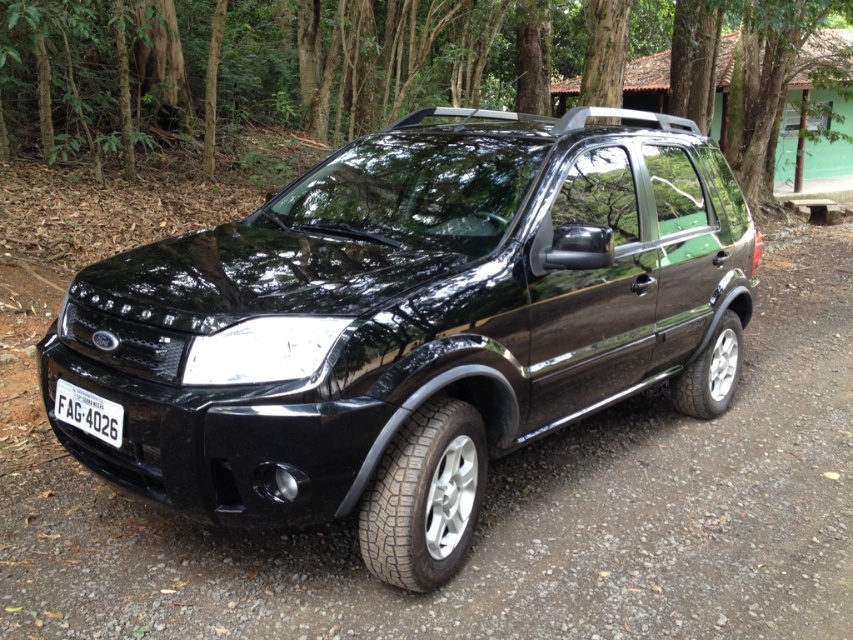
Question: Which of the following is the closest to the observer?

Choices:
 (A) black plastic license plate at lower left
 (B) green leafy tree at center
 (C) glossy black suv at center

Answer: (C)

Question: Is green leafy tree at center below black plastic license plate at lower left?

Choices:
 (A) no
 (B) yes

Answer: (A)

Question: Among these points, which one is farthest from the camera?

Choices:
 (A) (112, 436)
 (B) (688, 186)

Answer: (B)

Question: Does glossy black suv at center appear on the left side of green leafy tree at center?

Choices:
 (A) no
 (B) yes

Answer: (B)

Question: Which object is the closest to the black plastic license plate at lower left?

Choices:
 (A) green leafy tree at center
 (B) glossy black suv at center

Answer: (B)

Question: Can you confirm if glossy black suv at center is positioned below black plastic license plate at lower left?

Choices:
 (A) no
 (B) yes

Answer: (A)